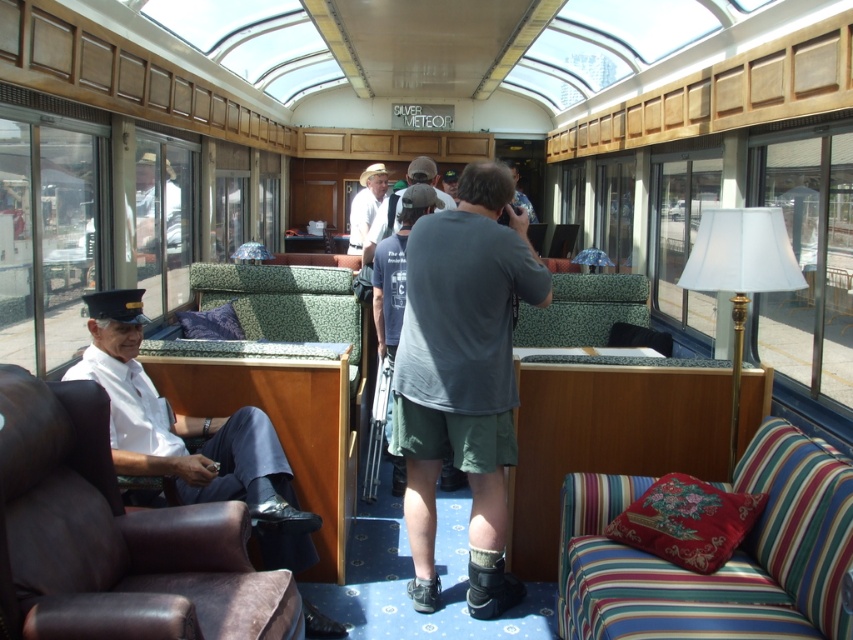
You are standing in the Silver Meteor train car and want to take a photo of both the point at coordinates (793, 266) and the point at coordinates (380, 164). Since you want both points to be in focus, which point should you focus on to ensure both are sharp?

You should focus on the point at coordinates (380, 164) because it is farther from the camera than the point at (793, 266). By focusing on the farther point, the closer point will also be within the depth of field, ensuring both are sharp.

You are a passenger sitting in the Silver Meteor train car. You notice a white fabric lampshade at right and a matte white shirt at center. Which object is closer to the ceiling?

The white fabric lampshade at right is positioned under the matte white shirt at center, so the matte white shirt at center is closer to the ceiling.